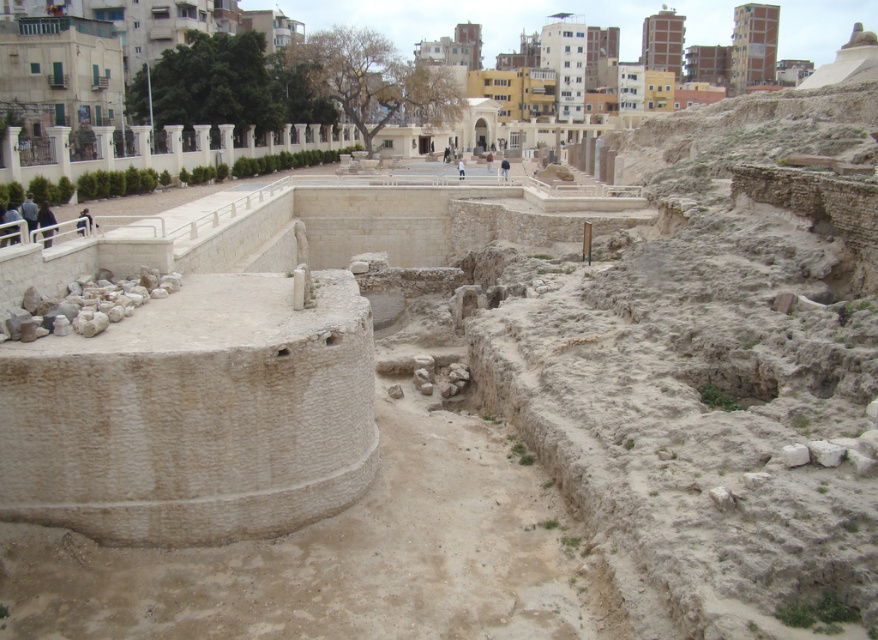
Which is behind, point (499, 168) or point (458, 160)?

Point (458, 160)

Does light brown leather jacket at center have a greater width compared to light blue fabric at center?

Yes, light brown leather jacket at center is wider than light blue fabric at center.

The image size is (878, 640). What do you see at coordinates (504, 168) in the screenshot?
I see `light brown leather jacket at center` at bounding box center [504, 168].

At what (x,y) coordinates should I click in order to perform the action: click on light brown leather jacket at center. Please return your answer as a coordinate pair (x, y). The image size is (878, 640). Looking at the image, I should click on (504, 168).

Who is positioned more to the left, dark blue fabric jacket at upper left or light blue fabric at center?

dark blue fabric jacket at upper left

Can you confirm if dark blue fabric jacket at upper left is shorter than light blue fabric at center?

Yes, dark blue fabric jacket at upper left is shorter than light blue fabric at center.

In order to click on dark blue fabric jacket at upper left in this screenshot , I will do `click(83, 221)`.

This screenshot has height=640, width=878. What are the coordinates of `dark blue fabric jacket at upper left` in the screenshot? It's located at (83, 221).

Between dark blue fabric jacket at upper left and light brown leather jacket at center, which one is positioned higher?

Positioned higher is light brown leather jacket at center.

Does dark blue fabric jacket at upper left lie in front of light brown leather jacket at center?

Yes, it is in front of light brown leather jacket at center.

Identify the location of dark blue fabric jacket at upper left. The width and height of the screenshot is (878, 640). (83, 221).